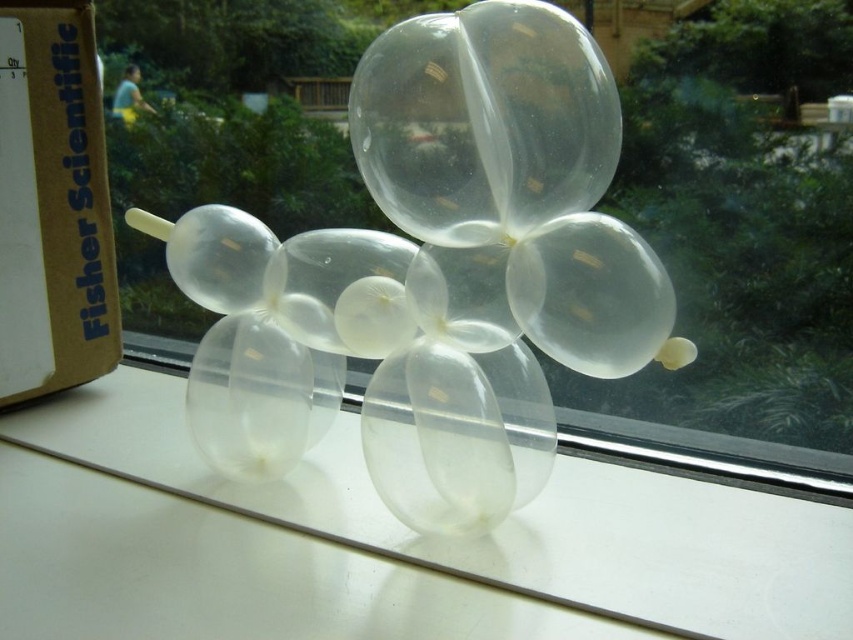
Question: Can you confirm if transparent plastic balloon at center is bigger than transparent plastic table at center?

Choices:
 (A) yes
 (B) no

Answer: (B)

Question: Which point appears closest to the camera in this image?

Choices:
 (A) (540, 189)
 (B) (785, 518)

Answer: (A)

Question: Is transparent plastic balloon at center bigger than transparent plastic table at center?

Choices:
 (A) yes
 (B) no

Answer: (B)

Question: Where is transparent plastic balloon at center located in relation to transparent plastic table at center in the image?

Choices:
 (A) above
 (B) below

Answer: (A)

Question: Which of the following is the closest to the observer?

Choices:
 (A) transparent plastic table at center
 (B) transparent plastic balloon at center

Answer: (A)